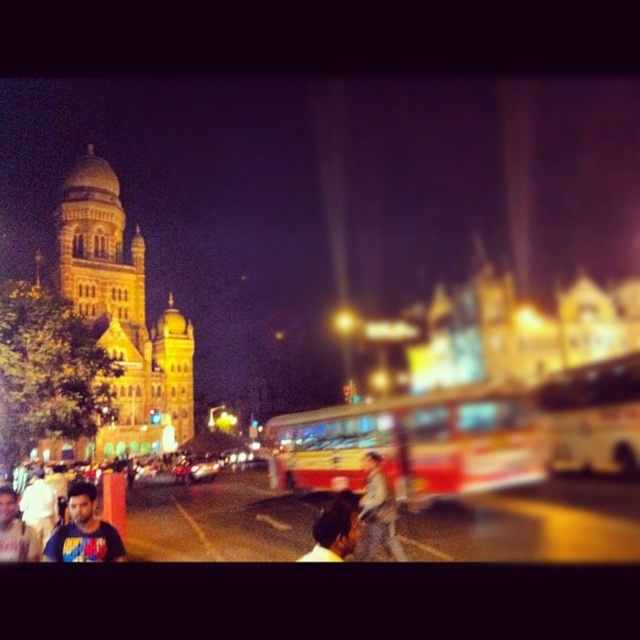
Question: Is yellow metallic bus at center further to the viewer compared to dark blue t-shirt at center?

Choices:
 (A) yes
 (B) no

Answer: (A)

Question: Which point is closer to the camera?

Choices:
 (A) click(550, 422)
 (B) click(316, 531)
 (C) click(364, 506)

Answer: (B)

Question: Among these points, which one is farthest from the camera?

Choices:
 (A) (342, 518)
 (B) (125, 408)
 (C) (392, 440)

Answer: (C)

Question: Can you confirm if golden stone tower at upper left is positioned above yellow painted metal bus at center?

Choices:
 (A) yes
 (B) no

Answer: (A)

Question: Is golden stone tower at upper left to the right of yellow painted metal bus at center from the viewer's perspective?

Choices:
 (A) yes
 (B) no

Answer: (B)

Question: Which object appears farthest from the camera in this image?

Choices:
 (A) yellow painted metal bus at center
 (B) dark blue shirt at lower left
 (C) dark brown hair at center
 (D) denim jacket at center

Answer: (A)